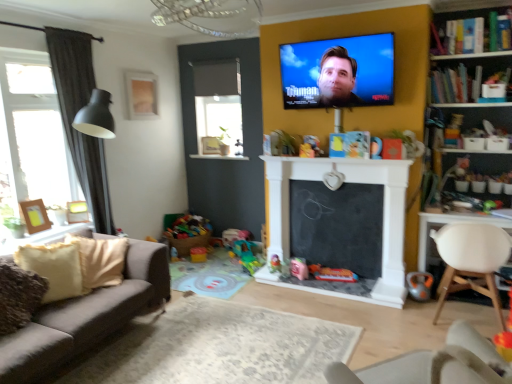
At what (x,y) coordinates should I click in order to perform the action: click on vacant area on top of wooden bookshelf at upper right (from a real-world perspective). Please return your answer as a coordinate pair (x, y). The width and height of the screenshot is (512, 384). Looking at the image, I should click on (463, 61).